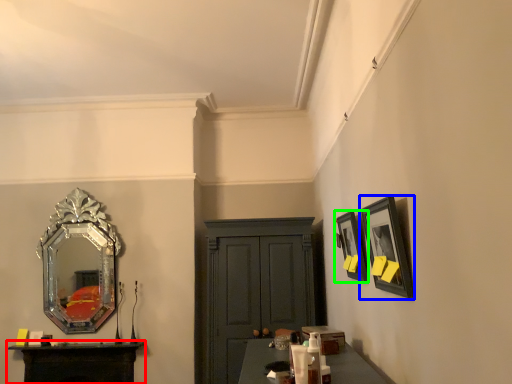
Question: Based on their relative distances, which object is farther from table (highlighted by a red box)? Choose from picture frame (highlighted by a blue box) and picture frame (highlighted by a green box).

Choices:
 (A) picture frame
 (B) picture frame

Answer: (A)